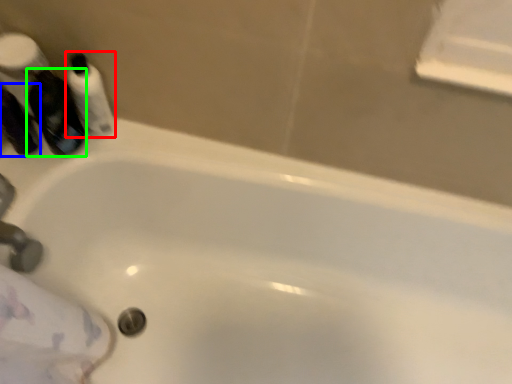
Question: Which object is the closest to the mouthwash (highlighted by a red box)? Choose among these: mouthwash (highlighted by a blue box) or mouthwash (highlighted by a green box).

Choices:
 (A) mouthwash
 (B) mouthwash

Answer: (B)